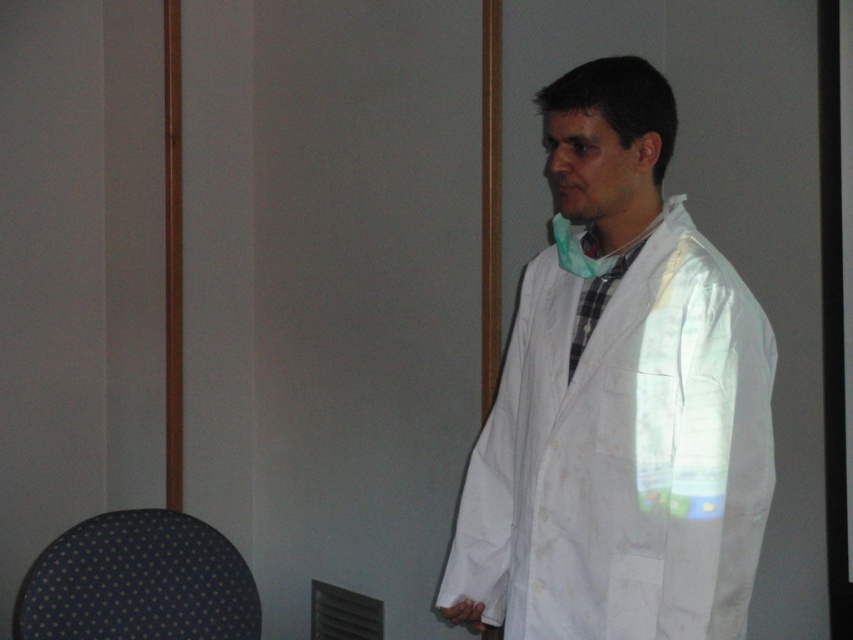
Question: Which point appears farthest from the camera in this image?

Choices:
 (A) (149, 602)
 (B) (711, 416)

Answer: (A)

Question: Which point is farther from the camera taking this photo?

Choices:
 (A) (236, 561)
 (B) (637, 529)

Answer: (A)

Question: Which of the following is the closest to the observer?

Choices:
 (A) white matte lab coat at center
 (B) dark blue fabric chair at lower left

Answer: (A)

Question: Is white matte lab coat at center to the left of dark blue fabric chair at lower left from the viewer's perspective?

Choices:
 (A) yes
 (B) no

Answer: (B)

Question: Is the position of white matte lab coat at center more distant than that of dark blue fabric chair at lower left?

Choices:
 (A) yes
 (B) no

Answer: (B)

Question: Observing the image, what is the correct spatial positioning of white matte lab coat at center in reference to dark blue fabric chair at lower left?

Choices:
 (A) above
 (B) below

Answer: (A)